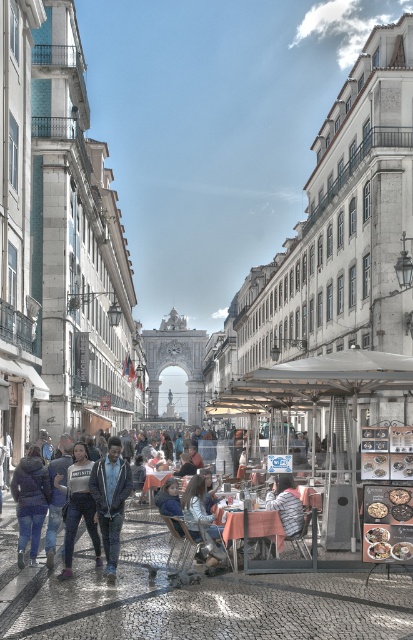
You are standing at the base of the archway and want to walk towards the nearest point between the two points, point (21, 499) and point (166, 472). Which point should you head towards?

You should head towards point (21, 499) because it is in front of point (166, 472), meaning it is closer to your current position at the base of the archway.

You are a tourist standing at the center of the cobblestone street in the image. You want to pick up the denim jacket at lower left. In which direction should you move to reach it?

The denim jacket at lower left is located at point (111,499). Since you are at the center, you should move towards the lower left direction to reach it.